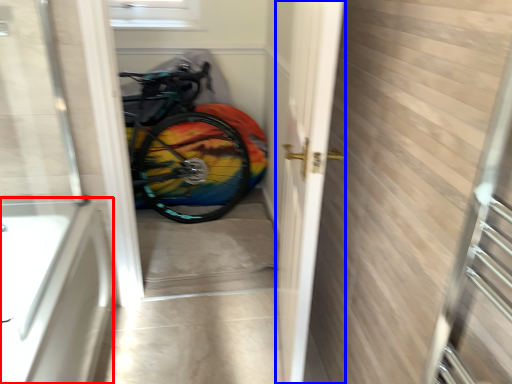
Question: Which of the following is the closest to the observer, bath (highlighted by a red box) or screen door (highlighted by a blue box)?

Choices:
 (A) bath
 (B) screen door

Answer: (B)